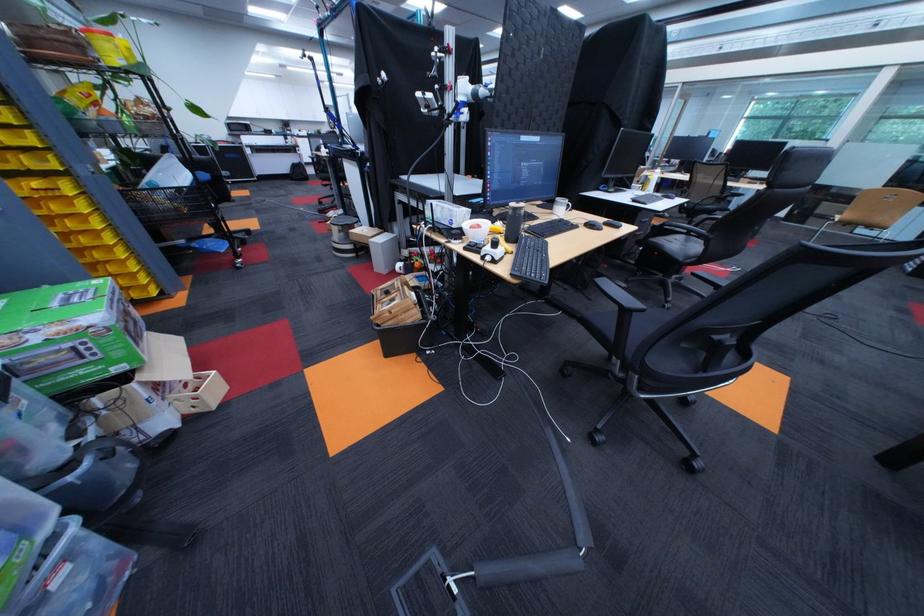
What do you see at coordinates (476, 229) in the screenshot? The image size is (924, 616). I see `the white ceramic bowl` at bounding box center [476, 229].